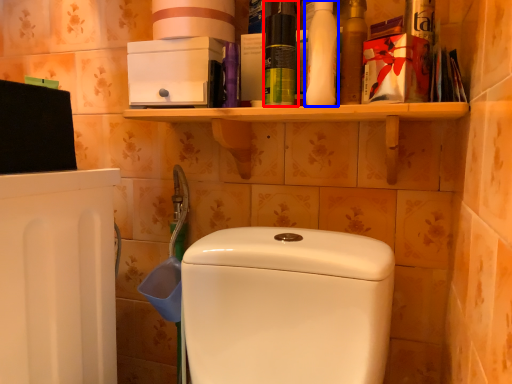
Question: Which object appears closest to the camera in this image, cleaning product (highlighted by a red box) or cleaning product (highlighted by a blue box)?

Choices:
 (A) cleaning product
 (B) cleaning product

Answer: (B)